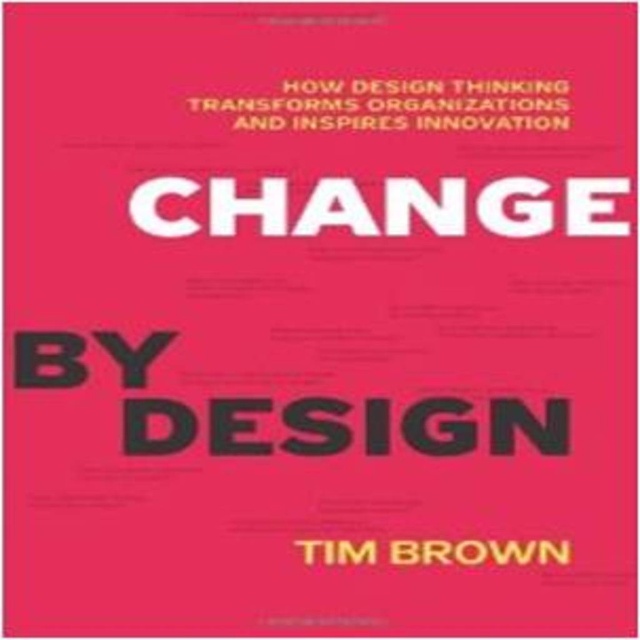
You are designing a book cover and need to ensure the yellow text at upper center and the whitetexttim brown at center are spaced appropriately. Based on the book cover described, which text is wider?

The yellow text at upper center is wider than whitetexttim brown at center according to the description.

You are designing a poster and want to ensure the white matte text at center and the yellow text at upper center are both visible. Based on their sizes, which text should you adjust to make them more balanced?

The yellow text at upper center is smaller than the white matte text at center. To balance them, you could increase the size of the yellow text at upper center or decrease the size of the white matte text at center.

You are looking at the book cover and want to touch the yellow text at upper center before touching the whitetexttim brown at center. Which one should you reach for first?

You should reach for the yellow text at upper center first because it is closer to you than the whitetexttim brown at center.